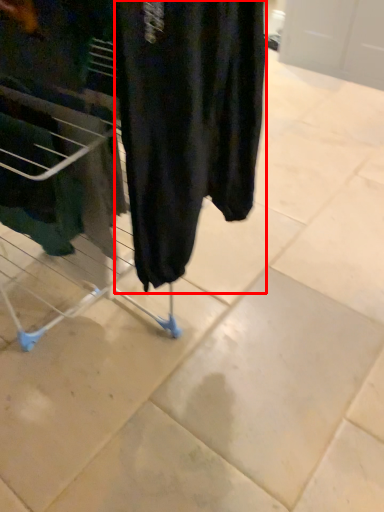
Question: From the image's perspective, what is the correct spatial positioning of clothing (annotated by the red box) in reference to furniture?

Choices:
 (A) below
 (B) above

Answer: (B)